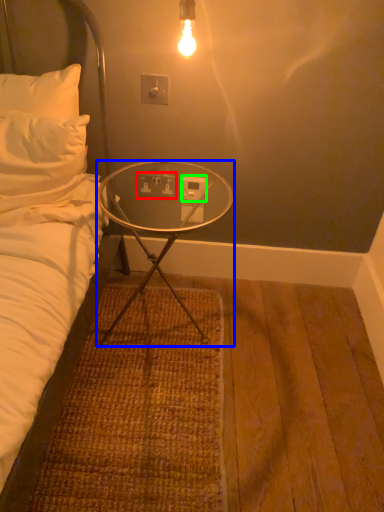
Question: Which object is the closest to the electric outlet (highlighted by a red box)? Choose among these: desk (highlighted by a blue box) or power outlet (highlighted by a green box).

Choices:
 (A) desk
 (B) power outlet

Answer: (B)